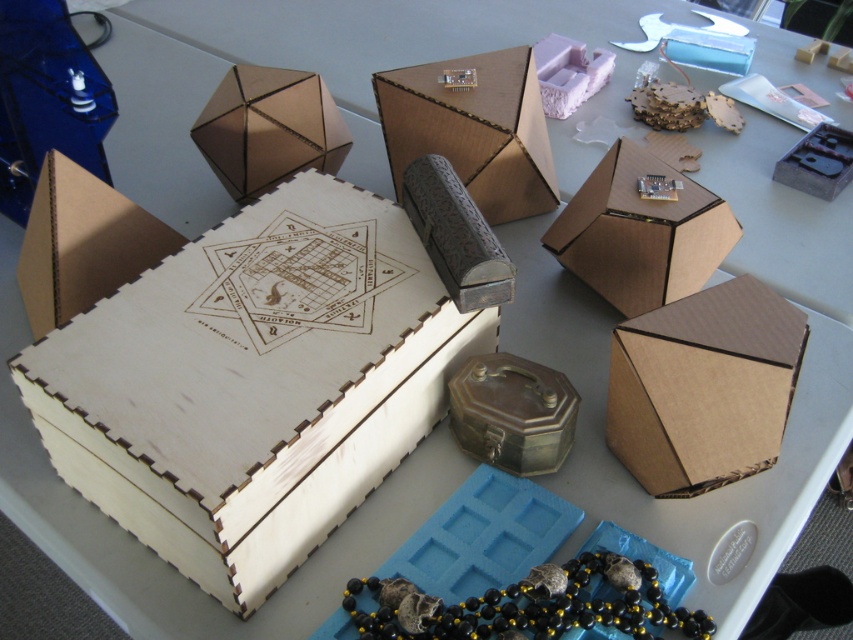
Is point (741, 353) closer to viewer compared to point (425, 150)?

Yes, it is in front of point (425, 150).

Can you confirm if brown cardboard box at center-right is taller than matte cardboard box at center?

No, brown cardboard box at center-right is not taller than matte cardboard box at center.

Does point (686, 426) lie in front of point (523, 141)?

Yes, it is in front of point (523, 141).

What are the coordinates of `brown cardboard box at center-right` in the screenshot? It's located at (703, 387).

Does matte cardboard box at center appear on the right side of brown cardboard box at center?

In fact, matte cardboard box at center is to the left of brown cardboard box at center.

Does point (409, 74) lie in front of point (618, 248)?

No, it is not.

The image size is (853, 640). What are the coordinates of `matte cardboard box at center` in the screenshot? It's located at (473, 129).

Is point (724, 426) positioned after point (688, 256)?

That is False.

Locate an element on the screen. The height and width of the screenshot is (640, 853). brown cardboard box at center-right is located at coordinates (703, 387).